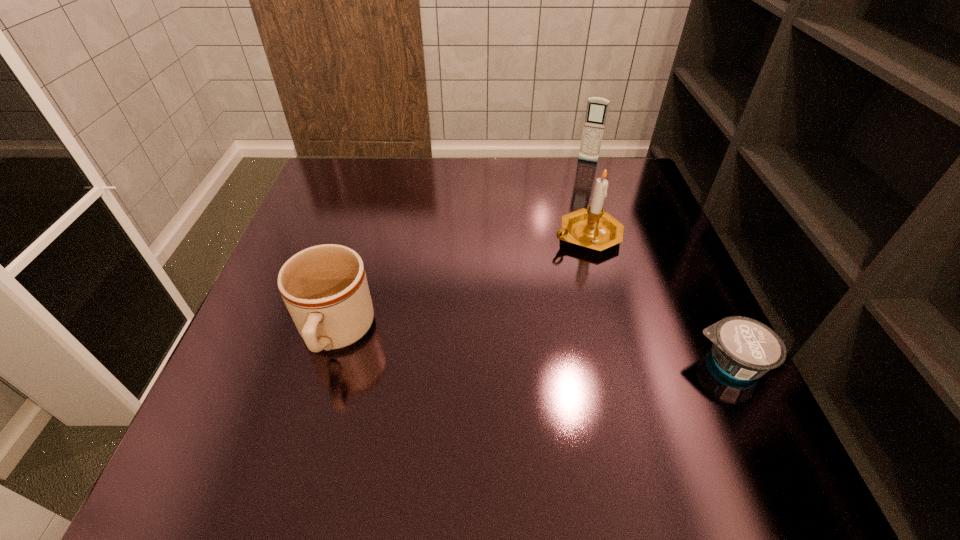
Where is `object that is the closest to the shortest object`? The image size is (960, 540). object that is the closest to the shortest object is located at coordinates (593, 228).

Where is `the closest object to the leftmost object`? This screenshot has width=960, height=540. the closest object to the leftmost object is located at coordinates (593, 228).

Locate an element on the screen. The image size is (960, 540). free region that satisfies the following two spatial constraints: 1. on the side of the rightmost object with the handle; 2. on the left side of the mug is located at coordinates (327, 363).

At what (x,y) coordinates should I click in order to perform the action: click on vacant space that satisfies the following two spatial constraints: 1. on the front side of the farthest object; 2. on the right side of the shortest object. Please return your answer as a coordinate pair (x, y). Looking at the image, I should click on (654, 363).

The height and width of the screenshot is (540, 960). Find the location of `vacant space that satisfies the following two spatial constraints: 1. on the side of the second shortest object with the handle; 2. on the left side of the shortest object`. vacant space that satisfies the following two spatial constraints: 1. on the side of the second shortest object with the handle; 2. on the left side of the shortest object is located at coordinates (327, 363).

Locate an element on the screen. The height and width of the screenshot is (540, 960). free space that satisfies the following two spatial constraints: 1. on the front side of the third nearest object; 2. on the left side of the rightmost object is located at coordinates (622, 363).

Where is `free space that satisfies the following two spatial constraints: 1. on the back side of the cellular telephone; 2. on the left side of the second farthest object`? The width and height of the screenshot is (960, 540). free space that satisfies the following two spatial constraints: 1. on the back side of the cellular telephone; 2. on the left side of the second farthest object is located at coordinates (567, 161).

You are a GUI agent. You are given a task and a screenshot of the screen. Output one action in this format:
    pyautogui.click(x=<x>, y=<y>)
    Task: Click on the free location that satisfies the following two spatial constraints: 1. on the side of the mug with the handle; 2. on the right side of the yogurt
    This screenshot has height=540, width=960.
    Given the screenshot: What is the action you would take?
    pyautogui.click(x=327, y=363)